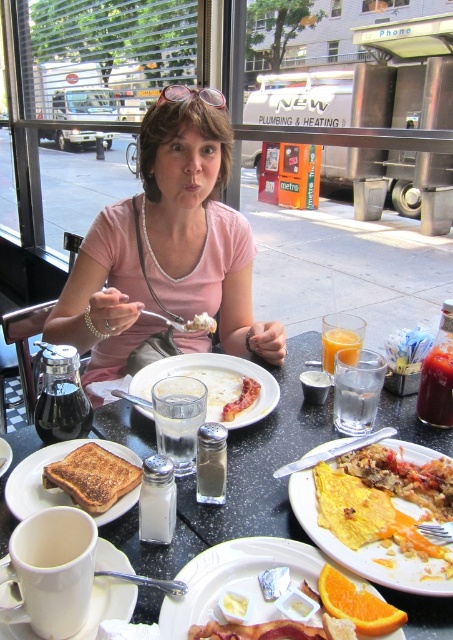
Does translucent glass cup at center appear on the right side of white fluffy cloud at center?

Indeed, translucent glass cup at center is positioned on the right side of white fluffy cloud at center.

Between point (352, 337) and point (184, 330), which one is positioned in front?

Positioned in front is point (352, 337).

Locate an element on the screen. Image resolution: width=453 pixels, height=640 pixels. translucent glass cup at center is located at coordinates tap(337, 344).

Is point (236, 321) positioned in front of point (358, 564)?

No.

This screenshot has height=640, width=453. In order to click on pink fabric shirt at center in this screenshot , I will do `click(167, 248)`.

This screenshot has height=640, width=453. What do you see at coordinates (167, 248) in the screenshot? I see `pink fabric shirt at center` at bounding box center [167, 248].

You are a GUI agent. You are given a task and a screenshot of the screen. Output one action in this format:
    pyautogui.click(x=<x>, y=<y>)
    Task: Click on the pink fabric shirt at center
    Image resolution: width=453 pixels, height=640 pixels.
    Given the screenshot: What is the action you would take?
    pyautogui.click(x=167, y=248)

Who is positioned more to the right, matte white plate with food at lower center or white matte plate at center?

matte white plate with food at lower center is more to the right.

Which is in front, point (197, 621) or point (149, 380)?

Positioned in front is point (197, 621).

Where is `matte white plate with food at lower center`? Image resolution: width=453 pixels, height=640 pixels. matte white plate with food at lower center is located at coordinates (236, 580).